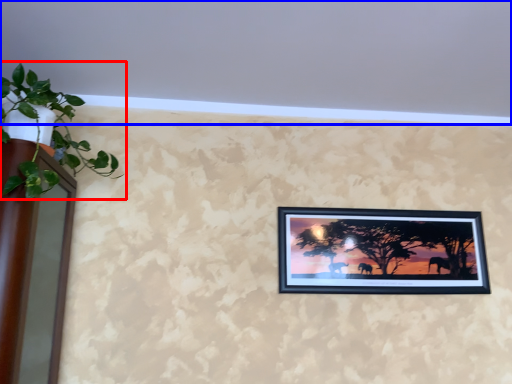
Question: Among these objects, which one is nearest to the camera, houseplant (highlighted by a red box) or backdrop (highlighted by a blue box)?

Choices:
 (A) houseplant
 (B) backdrop

Answer: (B)